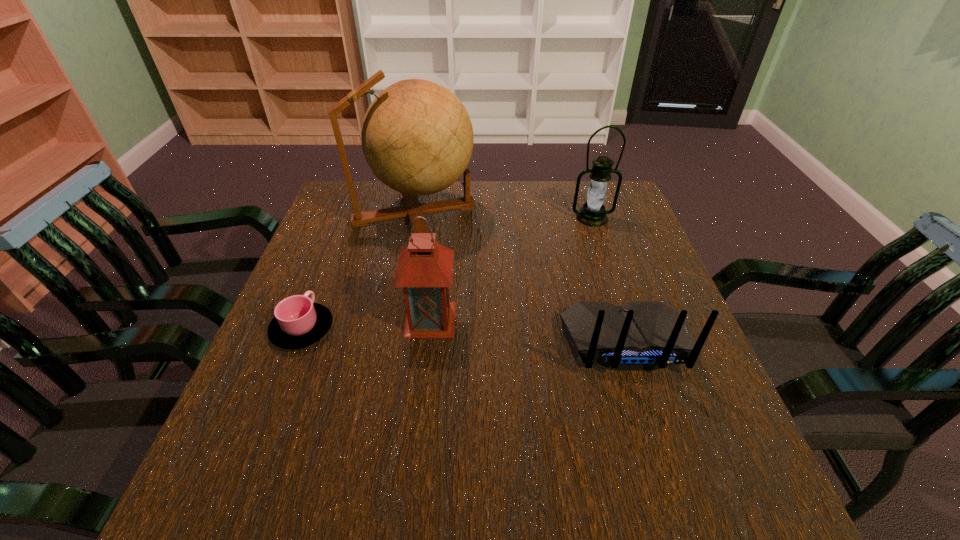
The width and height of the screenshot is (960, 540). I want to click on free space between the cup and the fourth tallest object, so click(464, 335).

This screenshot has height=540, width=960. I want to click on free space between the router and the nearer lantern, so click(x=528, y=330).

Identify the location of free spot between the left lantern and the second shortest object. click(528, 330).

The width and height of the screenshot is (960, 540). I want to click on the fourth closest object to the router, so click(299, 322).

Identify the location of the third closest object to the farther lantern. This screenshot has width=960, height=540. (425, 268).

Identify the location of free point that satisfies the following two spatial constraints: 1. on the surface of the nearer lantern; 2. on the left side of the tallest object. This screenshot has height=540, width=960. (394, 319).